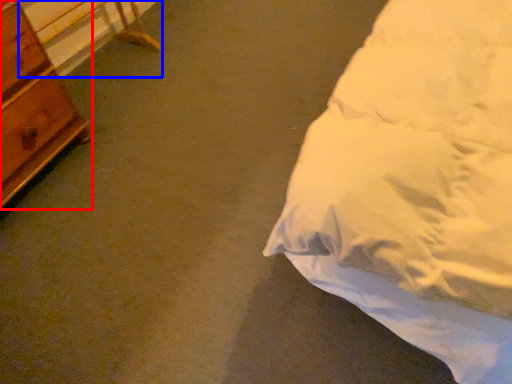
Question: Which of the following is the farthest to the observer, chest of drawers (highlighted by a red box) or table (highlighted by a blue box)?

Choices:
 (A) chest of drawers
 (B) table

Answer: (B)